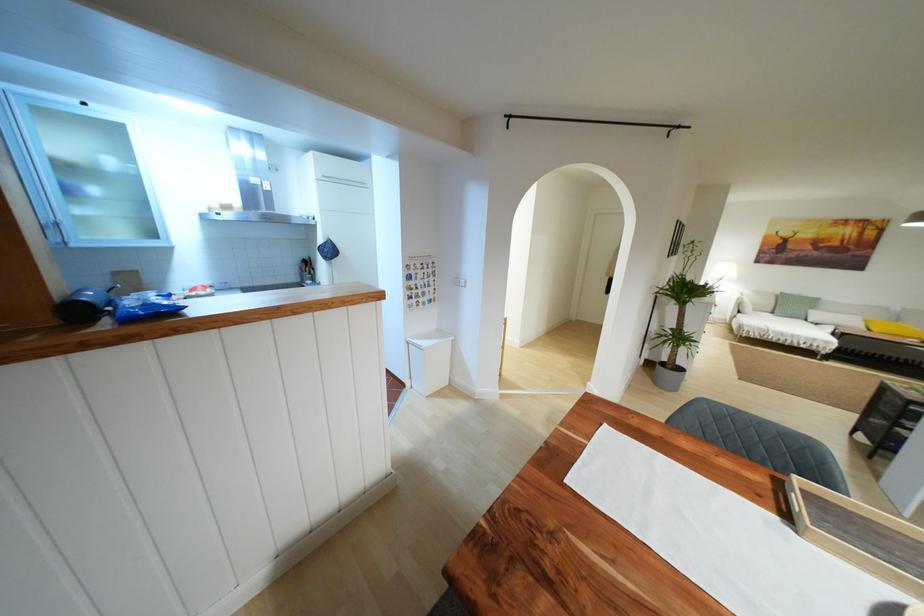
Identify the location of white door handle. (458, 283).